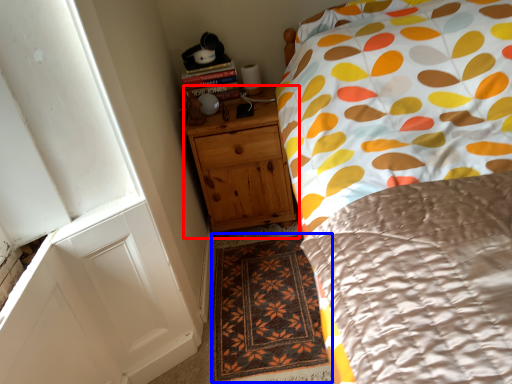
Question: Which point is further to the camera, chest of drawers (highlighted by a red box) or doormat (highlighted by a blue box)?

Choices:
 (A) chest of drawers
 (B) doormat

Answer: (A)